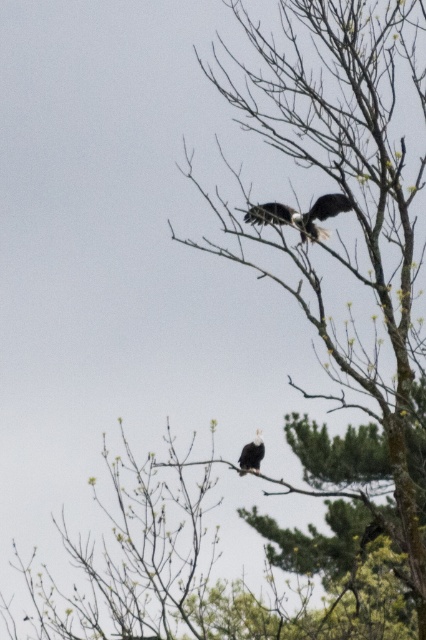
Which is behind, point (282, 218) or point (247, 444)?

Positioned behind is point (247, 444).

Does dark brown feathers at upper center have a greater height compared to white feathered eagle at upper right?

Yes.

Is point (325, 214) farther from camera compared to point (256, 444)?

No, it is not.

Where is `dark brown feathers at upper center`? Image resolution: width=426 pixels, height=640 pixels. dark brown feathers at upper center is located at coordinates (301, 214).